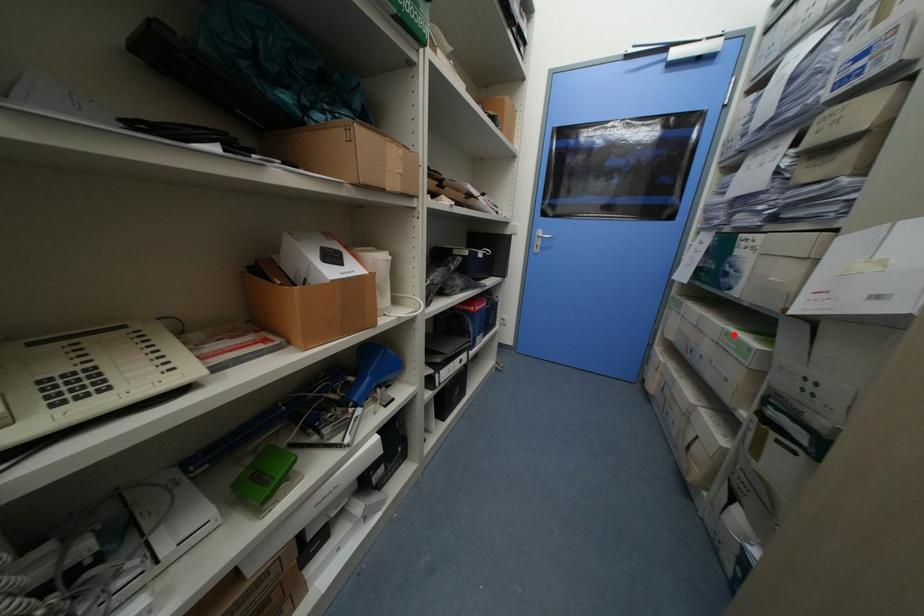
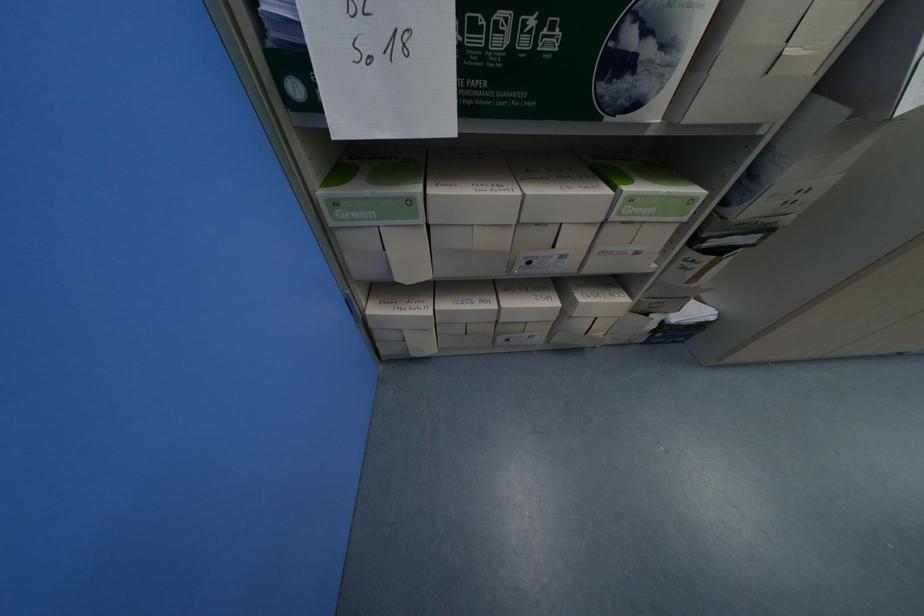
Where in the second image is the point corresponding to the highlighted location from the first image?

(638, 200)